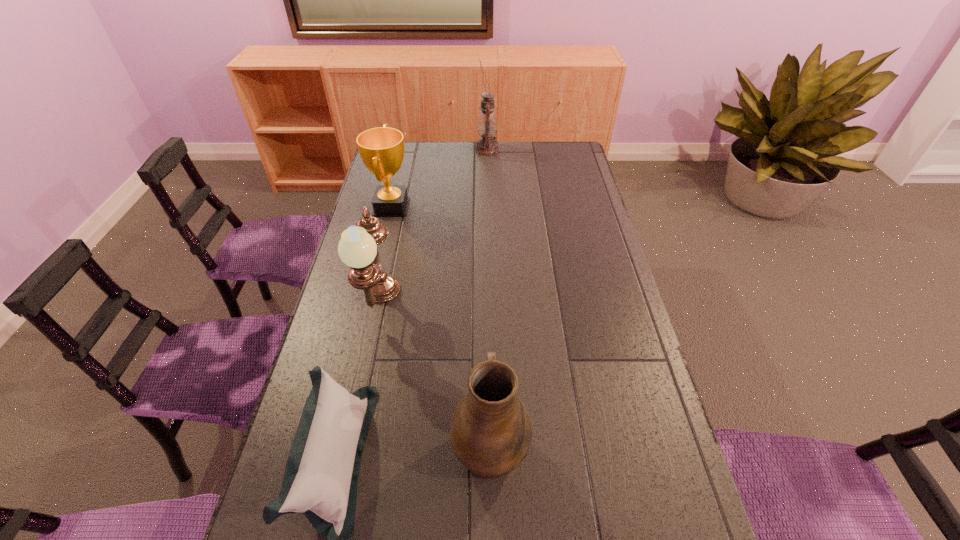
The width and height of the screenshot is (960, 540). I want to click on the right oil lamp, so click(x=487, y=125).

Locate an element on the screen. This screenshot has height=540, width=960. the farthest object is located at coordinates (487, 125).

Identify the location of the left oil lamp. The image size is (960, 540). (357, 248).

Locate an element on the screen. the nearer oil lamp is located at coordinates (357, 248).

What are the coordinates of `pitcher` in the screenshot? It's located at (491, 433).

You are a GUI agent. You are given a task and a screenshot of the screen. Output one action in this format:
    pyautogui.click(x=<x>, y=<y>)
    Task: Click on the second farthest object
    The height and width of the screenshot is (540, 960).
    Given the screenshot: What is the action you would take?
    pyautogui.click(x=382, y=149)

Where is `free space located on the left of the right oil lamp`? The height and width of the screenshot is (540, 960). free space located on the left of the right oil lamp is located at coordinates (429, 150).

This screenshot has width=960, height=540. Identify the location of vacant area located 0.380m on the back of the nearer oil lamp. (400, 208).

Where is `free space located 0.270m on the handle side of the pitcher`? The height and width of the screenshot is (540, 960). free space located 0.270m on the handle side of the pitcher is located at coordinates (488, 322).

Find the location of a particular element. free location located 0.400m on the handle side of the pitcher is located at coordinates (488, 290).